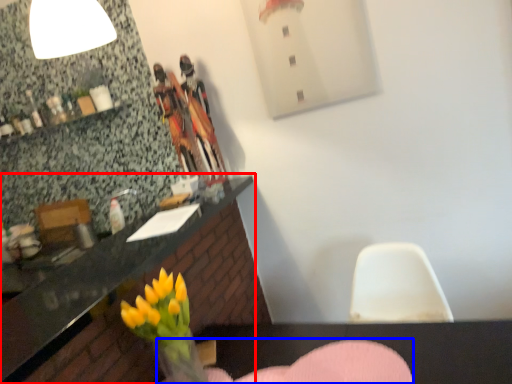
Question: Which object is further to the camera taking this photo, countertop (highlighted by a red box) or armchair (highlighted by a blue box)?

Choices:
 (A) countertop
 (B) armchair

Answer: (B)